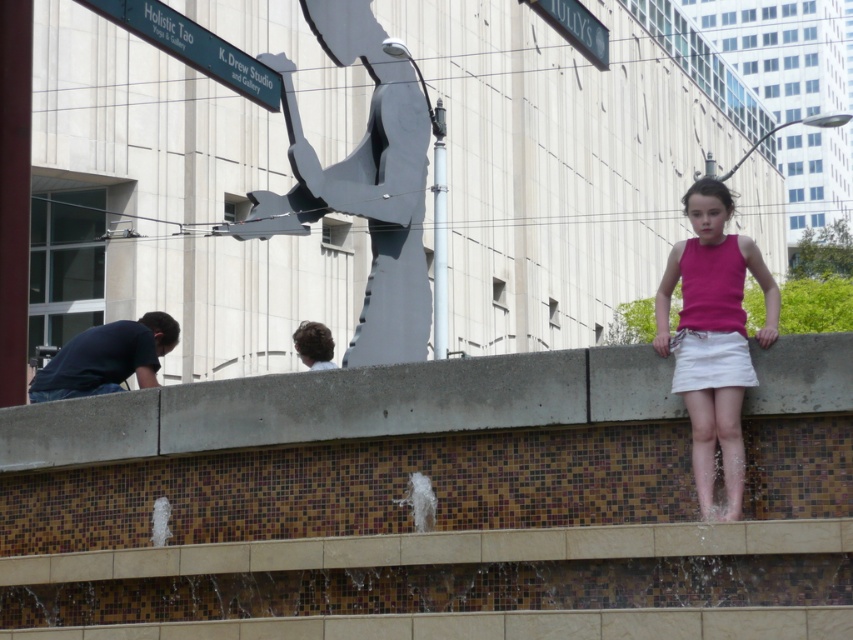
Does pink fabric skirt at right appear on the right side of white cotton skirt at center?

Yes, pink fabric skirt at right is to the right of white cotton skirt at center.

Is pink fabric skirt at right behind white cotton skirt at center?

No, it is not.

Which is behind, point (763, 288) or point (682, 365)?

The point (763, 288) is behind.

What are the coordinates of `pink fabric skirt at right` in the screenshot? It's located at (712, 337).

Is gray metallic sculpture at center thinner than white cotton skirt at center?

Incorrect, gray metallic sculpture at center's width is not less than white cotton skirt at center's.

Does point (282, 72) come farther from viewer compared to point (715, 376)?

That is True.

Where is `gray metallic sculpture at center`? The width and height of the screenshot is (853, 640). gray metallic sculpture at center is located at coordinates (363, 182).

Is gray metallic sculpture at center shorter than green metal sign at upper left?

Incorrect, gray metallic sculpture at center's height does not fall short of green metal sign at upper left's.

Can you confirm if gray metallic sculpture at center is thinner than green metal sign at upper left?

No, gray metallic sculpture at center is not thinner than green metal sign at upper left.

Which is behind, point (337, 170) or point (135, 8)?

Point (337, 170)

Find the location of `gray metallic sculpture at center`. gray metallic sculpture at center is located at coordinates (363, 182).